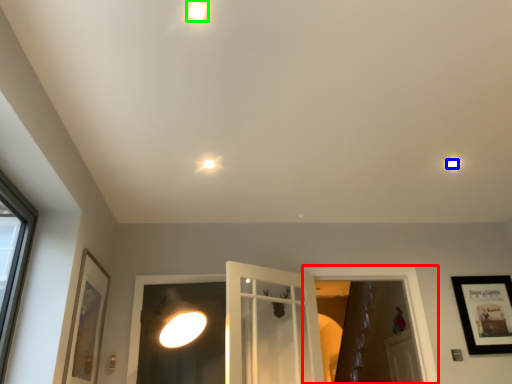
Question: Based on their relative distances, which object is farther from window frame (highlighted by a red box)? Choose from droplight (highlighted by a blue box) and droplight (highlighted by a green box).

Choices:
 (A) droplight
 (B) droplight

Answer: (B)